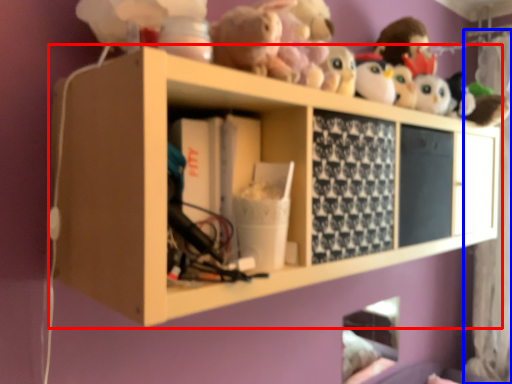
Question: Among these objects, which one is nearest to the camera, shelf (highlighted by a red box) or curtain (highlighted by a blue box)?

Choices:
 (A) shelf
 (B) curtain

Answer: (A)